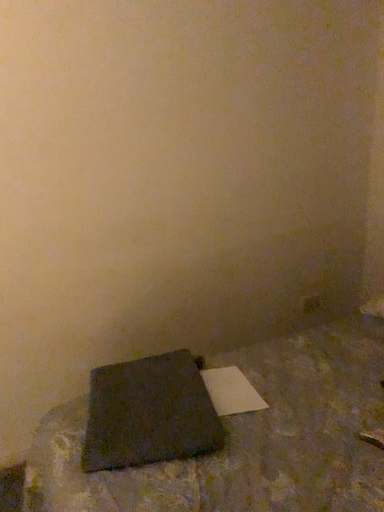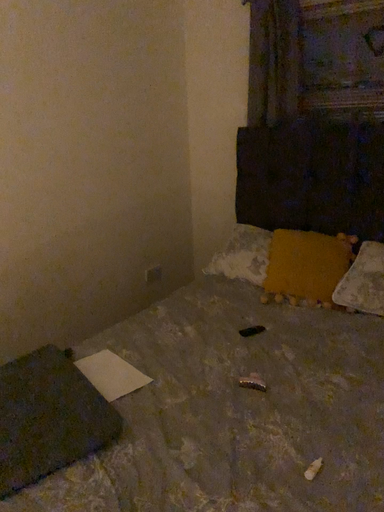
Question: Which way did the camera rotate in the video?

Choices:
 (A) rotated right
 (B) rotated left

Answer: (A)